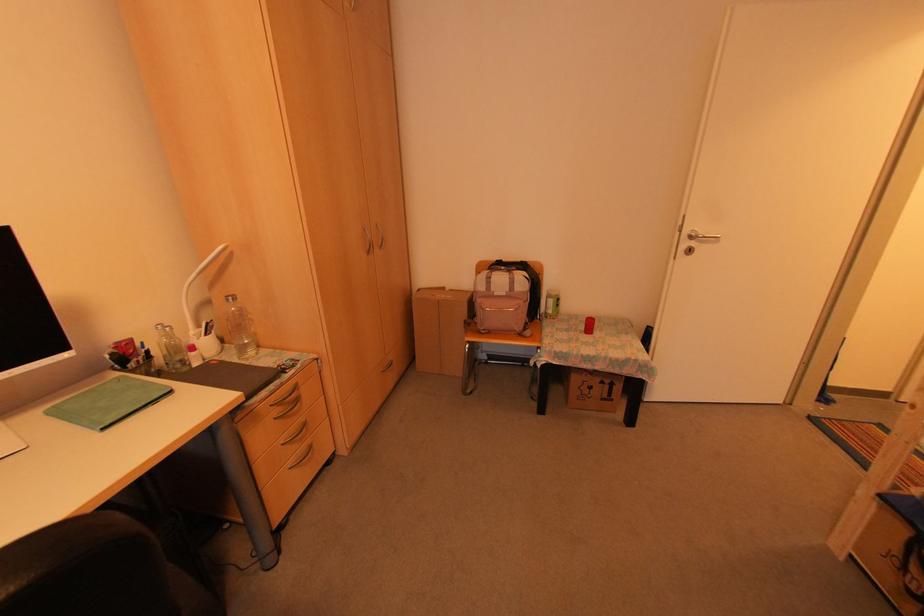
What do you see at coordinates (500, 314) in the screenshot? Image resolution: width=924 pixels, height=616 pixels. I see `the pink backpack handle` at bounding box center [500, 314].